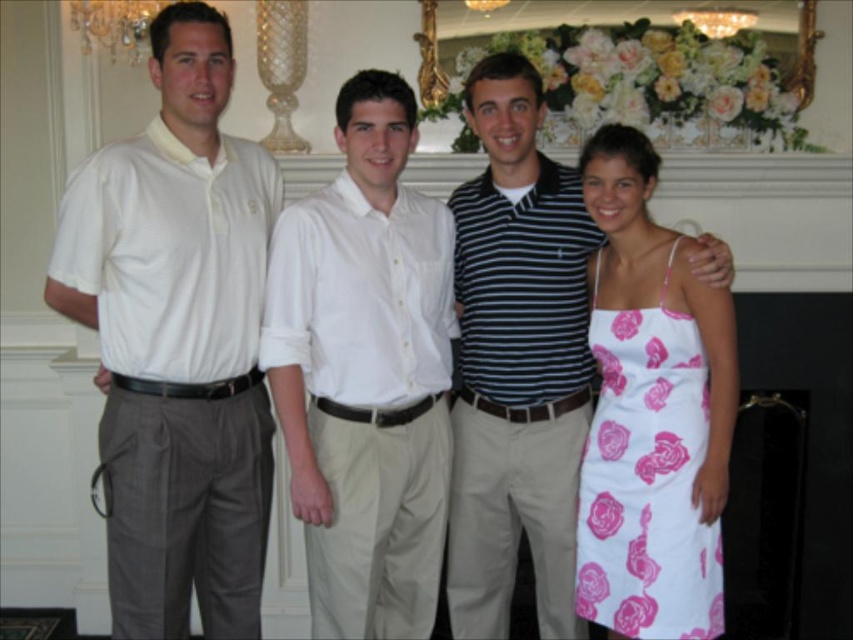
Question: Does pink floral fabric dress at right appear over crystal chandelier at upper left?

Choices:
 (A) no
 (B) yes

Answer: (A)

Question: Which point is farther to the camera?

Choices:
 (A) crystal chandelier at upper left
 (B) pink floral fabric dress at right

Answer: (A)

Question: Which of the following is the closest to the observer?

Choices:
 (A) (503, 445)
 (B) (88, 33)

Answer: (A)

Question: Does pink floral fabric dress at right appear on the left side of crystal chandelier at upper left?

Choices:
 (A) yes
 (B) no

Answer: (B)

Question: Which of the following is the farthest from the observer?

Choices:
 (A) (131, 52)
 (B) (114, 604)

Answer: (A)

Question: Is white cotton shirt at center thinner than striped polo shirt at center?

Choices:
 (A) no
 (B) yes

Answer: (A)